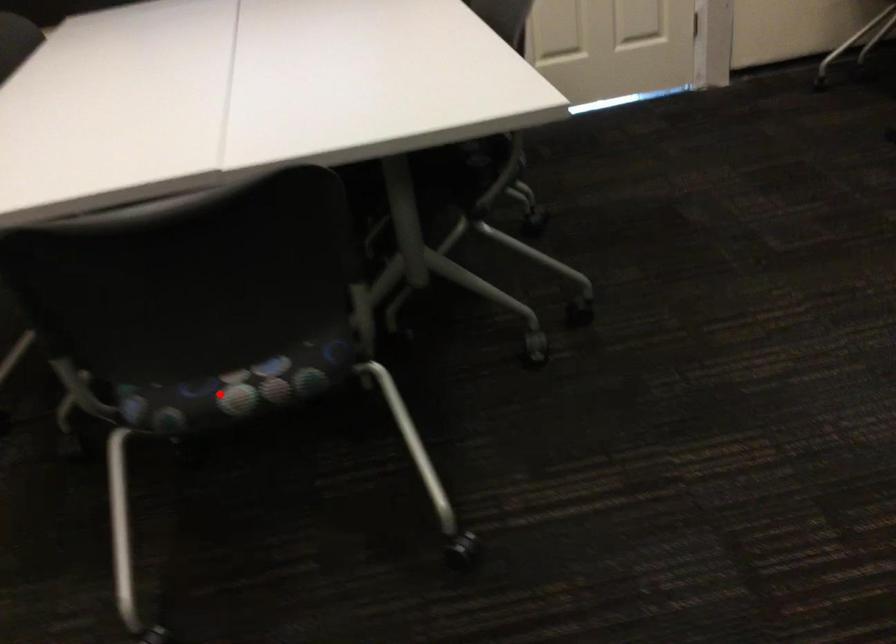
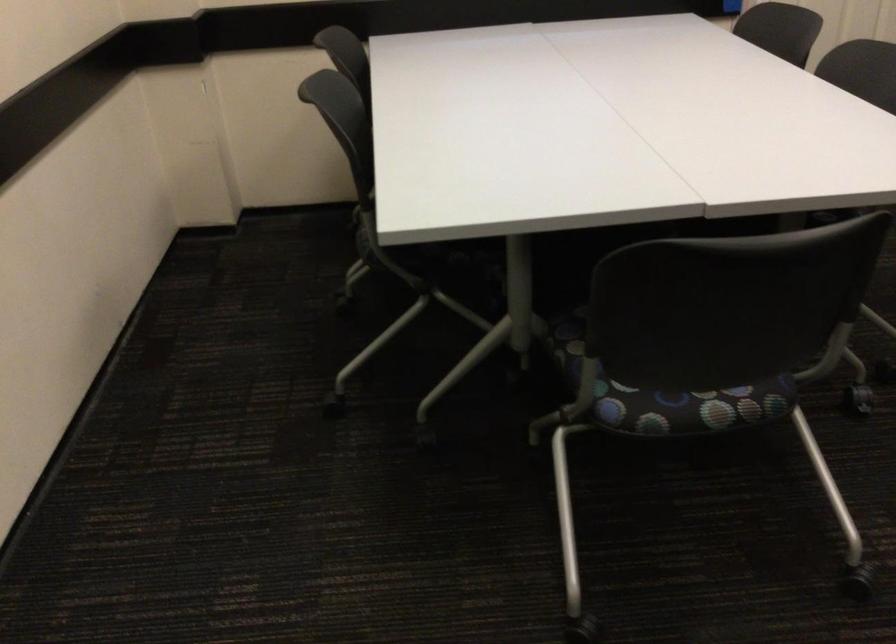
Where in the second image is the point corresponding to the highlighted location from the first image?

(688, 406)